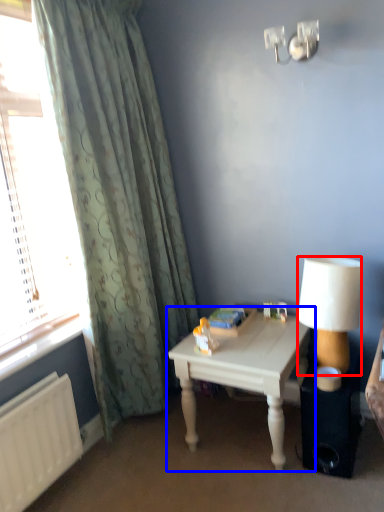
Question: Which object appears closest to the camera in this image, lamp (highlighted by a red box) or table (highlighted by a blue box)?

Choices:
 (A) lamp
 (B) table

Answer: (A)